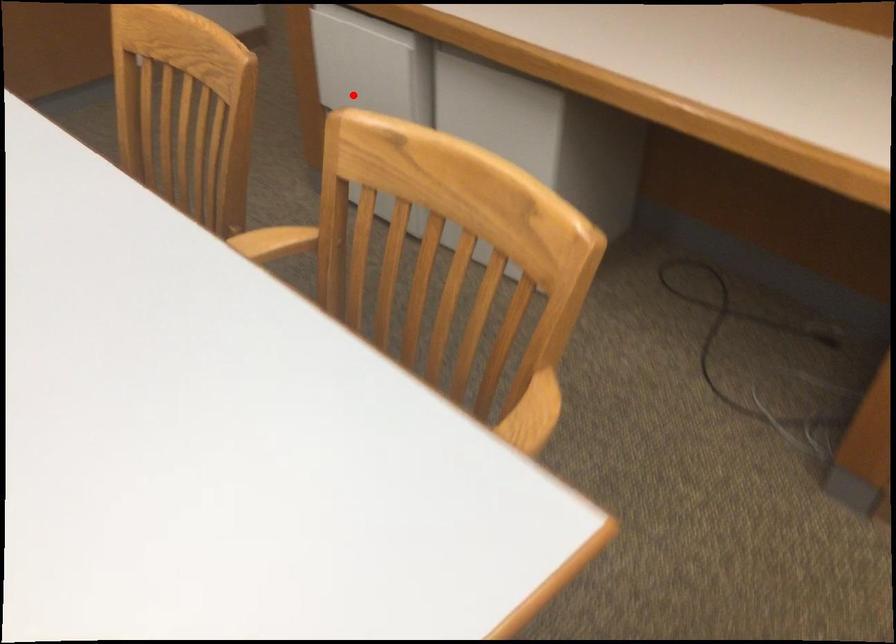
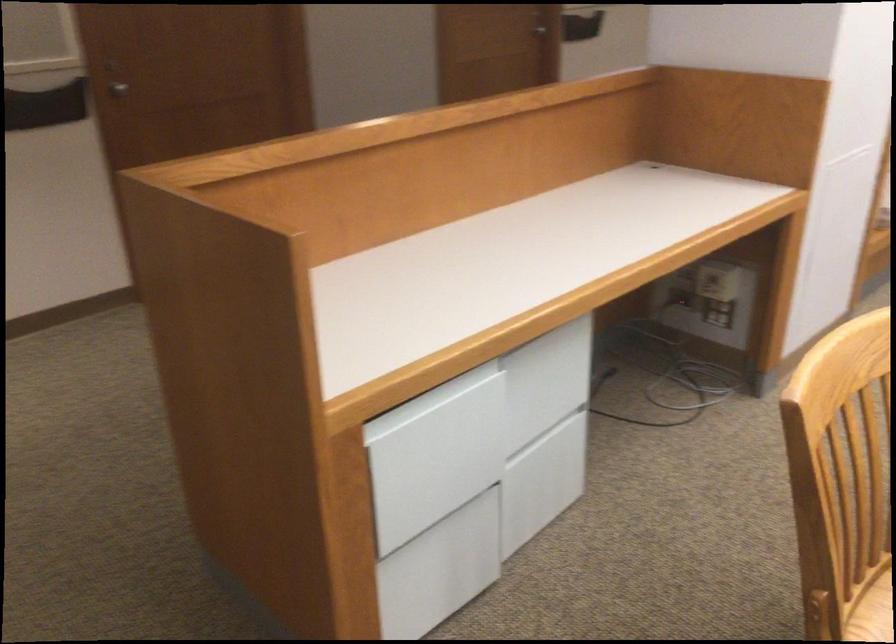
The point at the highlighted location is marked in the first image. Where is the corresponding point in the second image?

(436, 500)